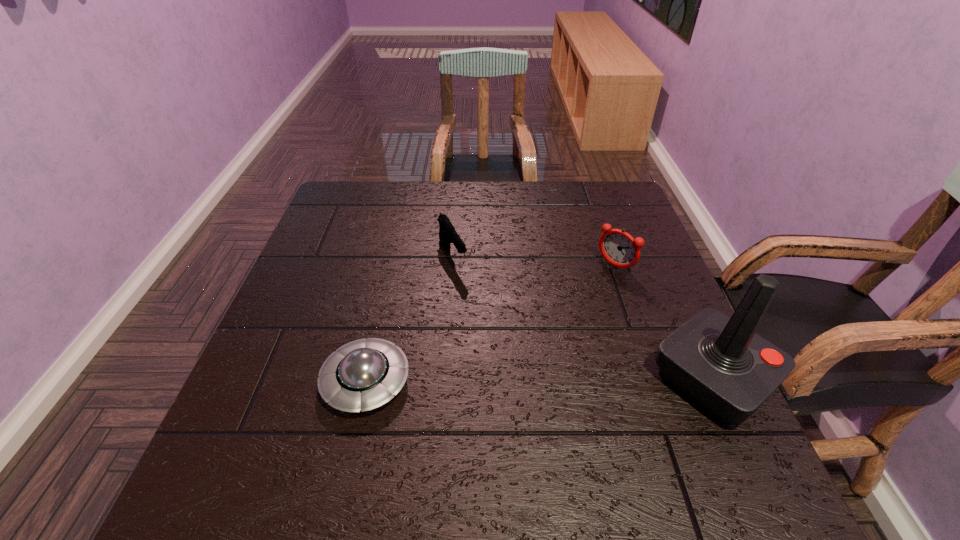
Locate an element on the screen. This screenshot has width=960, height=540. object present at the near right corner is located at coordinates (719, 362).

This screenshot has height=540, width=960. I want to click on vacant area at the far edge, so click(x=568, y=202).

This screenshot has width=960, height=540. Find the location of `free space at the near edge of the desktop`. free space at the near edge of the desktop is located at coordinates (534, 449).

Identify the location of vacant space at the left edge. This screenshot has height=540, width=960. (336, 236).

Locate an element on the screen. vacant region at the right edge is located at coordinates (613, 285).

Identify the location of blank area at the far right corner. (580, 200).

You are a GUI agent. You are given a task and a screenshot of the screen. Output one action in this format:
    pyautogui.click(x=<x>, y=<y>)
    Task: Click on the empty space that is in between the tallest object and the leftmost object
    The width and height of the screenshot is (960, 540).
    Given the screenshot: What is the action you would take?
    pyautogui.click(x=540, y=380)

This screenshot has height=540, width=960. In order to click on empty space between the leftmost object and the tallest object in this screenshot , I will do `click(540, 380)`.

You are a GUI agent. You are given a task and a screenshot of the screen. Output one action in this format:
    pyautogui.click(x=<x>, y=<y>)
    Task: Click on the free space between the joystick and the leftmost object
    This screenshot has height=540, width=960.
    Given the screenshot: What is the action you would take?
    pyautogui.click(x=540, y=380)

Identify the location of free space between the alarm clock and the tallest object. This screenshot has width=960, height=540. (663, 322).